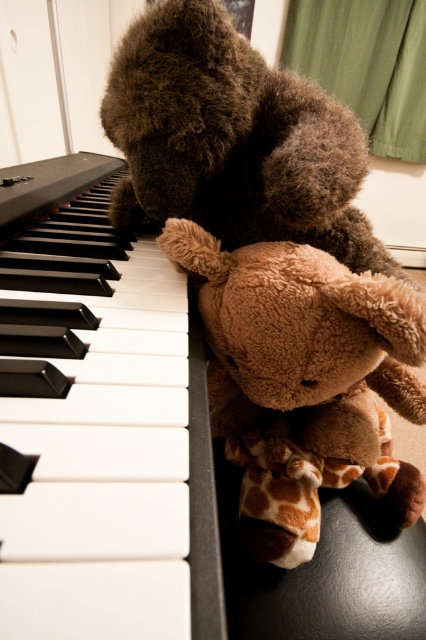
Between black matte piano keys at left and brown plush teddy bear at center, which one appears on the left side from the viewer's perspective?

Positioned to the left is black matte piano keys at left.

Locate an element on the screen. black matte piano keys at left is located at coordinates (100, 426).